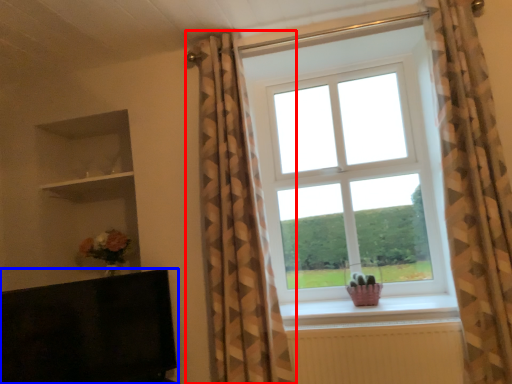
Question: Which object appears closest to the camera in this image, curtain (highlighted by a red box) or furniture (highlighted by a blue box)?

Choices:
 (A) curtain
 (B) furniture

Answer: (B)